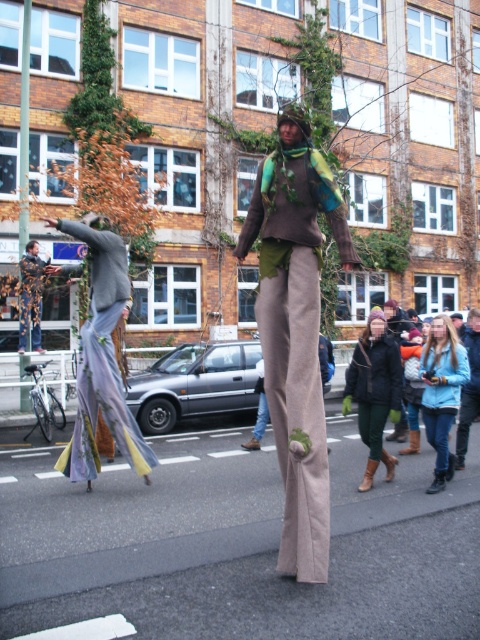
In the scene shown: Can you confirm if textured brown pants at center is positioned to the left of matte brown pants at center?

Indeed, textured brown pants at center is positioned on the left side of matte brown pants at center.

Does textured brown pants at center lie behind matte brown pants at center?

No, textured brown pants at center is closer to the viewer.

The image size is (480, 640). Identify the location of textured brown pants at center. (296, 330).

Does textured brown pants at center have a greater width compared to dark brown leather boots at center?

Yes.

Is textured brown pants at center further to the viewer compared to dark brown leather boots at center?

No, it is not.

Identify the location of textured brown pants at center. The width and height of the screenshot is (480, 640). [296, 330].

At what (x,y) coordinates should I click in order to perform the action: click on textured brown pants at center. Please return your answer as a coordinate pair (x, y). Looking at the image, I should click on (296, 330).

In the scene shown: Between gray fabric figure at left and matte brown pants at center, which one has more height?

Standing taller between the two is gray fabric figure at left.

What are the coordinates of `gray fabric figure at left` in the screenshot? It's located at (101, 362).

Locate an element on the screen. This screenshot has width=480, height=640. gray fabric figure at left is located at coordinates (101, 362).